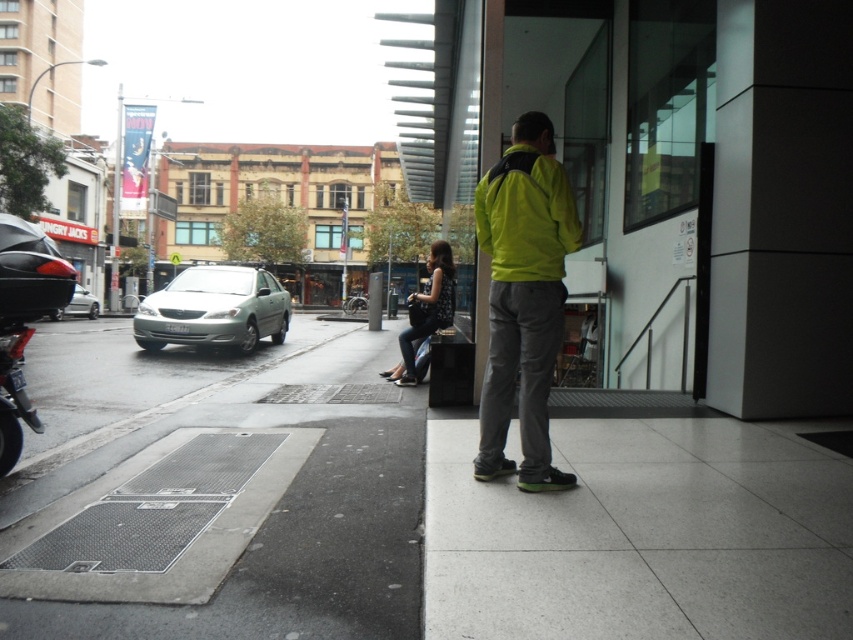
Measure the distance between satin silver sedan at center and black matte motorcycle at left.

satin silver sedan at center is 8.61 meters from black matte motorcycle at left.

Is satin silver sedan at center positioned in front of black matte motorcycle at left?

No, satin silver sedan at center is further to the viewer.

Does point (252, 273) lie in front of point (33, 298)?

No, (252, 273) is further to viewer.

This screenshot has width=853, height=640. Identify the location of satin silver sedan at center. (213, 308).

Which of these two, black matte motorcycle at left or silver metallic sedan at left, stands shorter?

black matte motorcycle at left

Between black matte motorcycle at left and silver metallic sedan at left, which one is positioned higher?

silver metallic sedan at left is above.

Is point (7, 432) positioned behind point (91, 317)?

No, it is not.

Identify the location of black matte motorcycle at left. Image resolution: width=853 pixels, height=640 pixels. (22, 321).

Does neon yellow jacket at center appear on the right side of black textured dress at center?

Indeed, neon yellow jacket at center is positioned on the right side of black textured dress at center.

Which is more to the right, neon yellow jacket at center or black textured dress at center?

neon yellow jacket at center is more to the right.

Between point (488, 220) and point (419, 330), which one is positioned in front?

Point (488, 220) is more forward.

The height and width of the screenshot is (640, 853). I want to click on neon yellow jacket at center, so click(x=523, y=298).